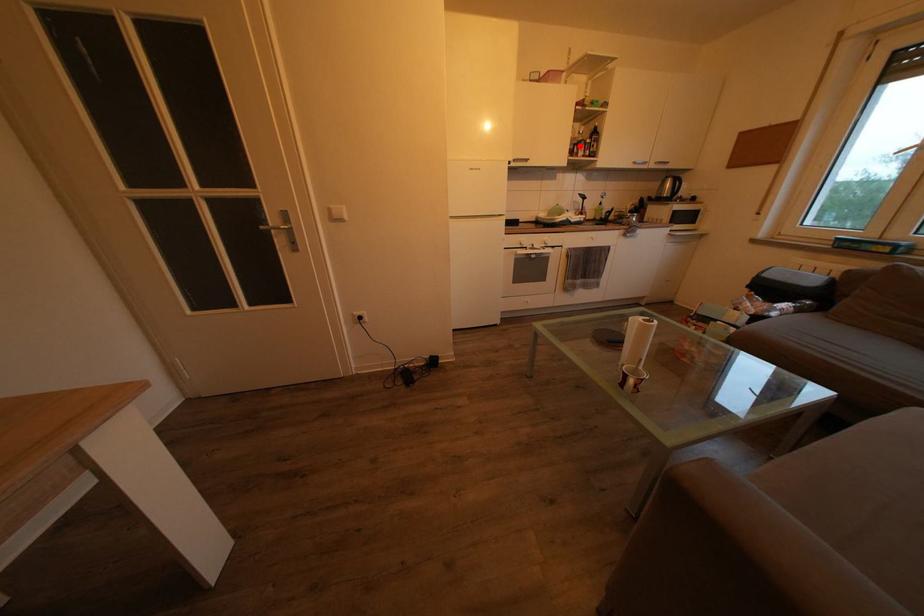
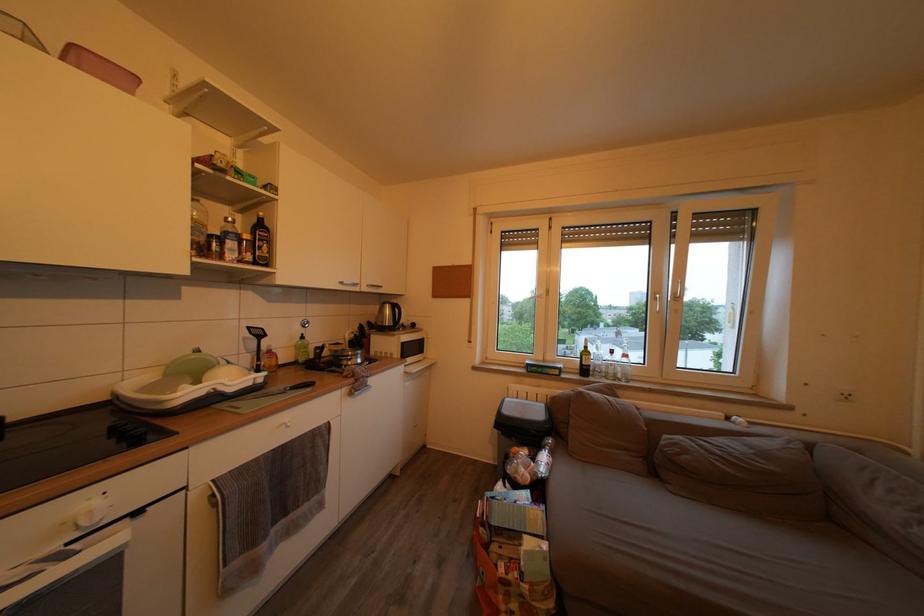
Question: A red point is marked in image1. In image2, is the corresponding 3D point closer to the camera or farther? Reply with the corresponding letter.

Choices:
 (A) The corresponding 3D point is closer.
 (B) The corresponding 3D point is farther.

Answer: (B)